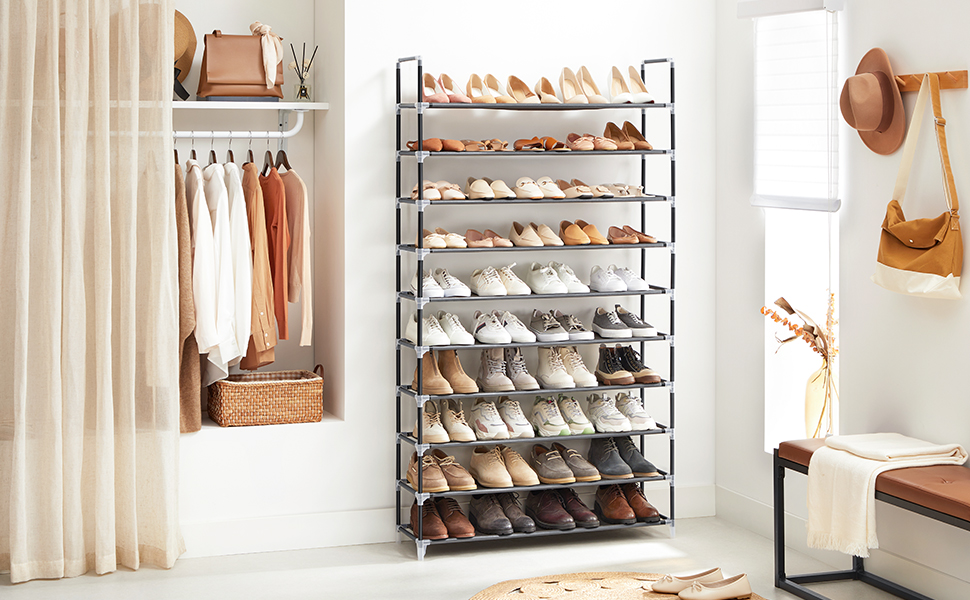
Where is `clothes hanging`? The height and width of the screenshot is (600, 970). clothes hanging is located at coordinates (294, 203), (278, 199), (255, 203), (235, 209), (220, 211), (198, 223), (177, 223).